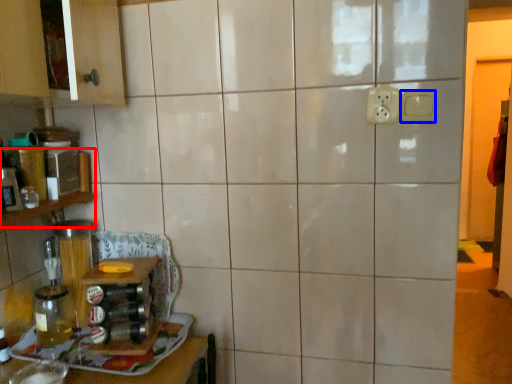
Question: Which point is further to the camera, shelf (highlighted by a red box) or electric outlet (highlighted by a blue box)?

Choices:
 (A) shelf
 (B) electric outlet

Answer: (B)